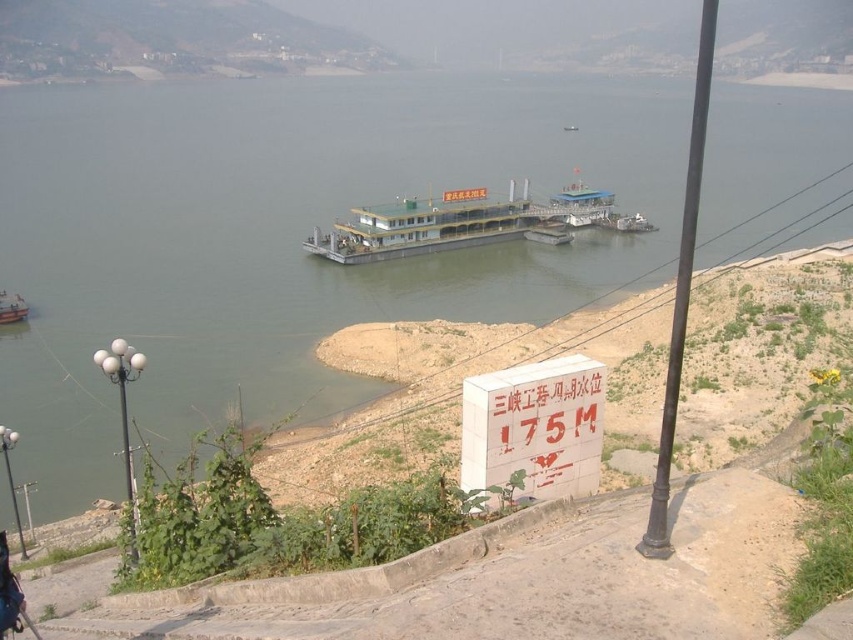
Which is in front, point (526, 461) or point (1, 316)?

Positioned in front is point (526, 461).

Measure the distance between white concrete sign at lower center and orange plastic boat at lower left.

A distance of 46.85 meters exists between white concrete sign at lower center and orange plastic boat at lower left.

Who is more forward, (584, 476) or (26, 308)?

Point (584, 476) is more forward.

Locate an element on the screen. Image resolution: width=853 pixels, height=640 pixels. white concrete sign at lower center is located at coordinates (534, 428).

Does green metallic ferry at center come in front of white concrete sign at lower center?

No, green metallic ferry at center is further to the viewer.

Who is more distant from viewer, [538,317] or [569,368]?

The point [538,317] is more distant.

Which is behind, point (56, 397) or point (564, 486)?

Positioned behind is point (56, 397).

Find the location of `green metallic ferry at center`. green metallic ferry at center is located at coordinates (283, 240).

Based on the photo, who is more distant from viewer, (410, 189) or (10, 323)?

Point (410, 189)

The image size is (853, 640). What do you see at coordinates (283, 240) in the screenshot?
I see `green metallic ferry at center` at bounding box center [283, 240].

This screenshot has width=853, height=640. In order to click on green metallic ferry at center in this screenshot , I will do `click(283, 240)`.